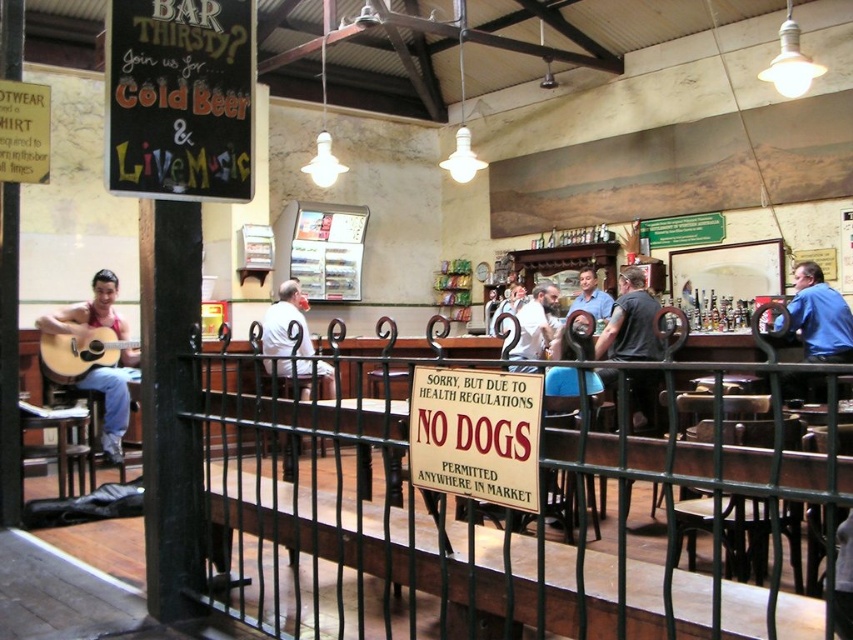
Is black chalkboard at upper left closer to the viewer compared to matte red shirt at left?

Yes, black chalkboard at upper left is in front of matte red shirt at left.

Who is more forward, (228, 154) or (74, 324)?

Point (228, 154) is in front.

Is point (242, 61) positioned behind point (105, 292)?

No.

You are a GUI agent. You are given a task and a screenshot of the screen. Output one action in this format:
    pyautogui.click(x=<x>, y=<y>)
    Task: Click on the black chalkboard at upper left
    This screenshot has width=853, height=640.
    Given the screenshot: What is the action you would take?
    pyautogui.click(x=180, y=99)

Is matte red shirt at left below acoustic wood guitar at left?

Indeed, matte red shirt at left is positioned under acoustic wood guitar at left.

I want to click on matte red shirt at left, so click(113, 397).

At what (x,y) coordinates should I click in order to perform the action: click on matte red shirt at left. Please return your answer as a coordinate pair (x, y). This screenshot has height=640, width=853. Looking at the image, I should click on (113, 397).

Locate an element on the screen. matte red shirt at left is located at coordinates (113, 397).

Looking at this image, between black wrought iron fence at center and blue shirt at right, which one appears on the left side from the viewer's perspective?

black wrought iron fence at center is more to the left.

Can you confirm if black wrought iron fence at center is taller than blue shirt at right?

Indeed, black wrought iron fence at center has a greater height compared to blue shirt at right.

Is point (492, 449) positioned before point (834, 352)?

That is True.

What are the coordinates of `black wrought iron fence at center` in the screenshot? It's located at click(480, 504).